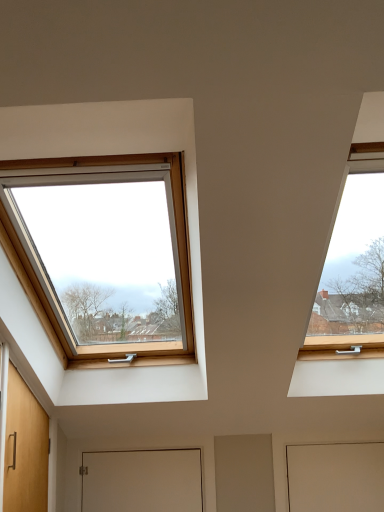
Identify the location of white matte door at lower right, the 2th door from the left. This screenshot has width=384, height=512. (336, 477).

Describe the element at coordinates (336, 477) in the screenshot. The image size is (384, 512). I see `white matte door at lower right, the first door in the right-to-left sequence` at that location.

Measure the distance between white matte door at lower right, the first door in the right-to-left sequence, and camera.

Answer: white matte door at lower right, the first door in the right-to-left sequence, is 8.12 feet from camera.

Describe the element at coordinates (142, 481) in the screenshot. This screenshot has width=384, height=512. I see `white matte door at center, the 1th door in the left-to-right sequence` at that location.

What is the approximate width of white matte door at center, the 1th door in the left-to-right sequence?

The width of white matte door at center, the 1th door in the left-to-right sequence, is 3.54 centimeters.

The width and height of the screenshot is (384, 512). Identify the location of white matte door at center, the 2th door when ordered from right to left. (142, 481).

At what (x,y) coordinates should I click in order to perform the action: click on white matte door at lower right, the first door in the right-to-left sequence. Please return your answer as a coordinate pair (x, y). Looking at the image, I should click on (336, 477).

Based on the photo, is white matte door at center, the 2th door when ordered from right to left, at the right side of white matte door at lower right, the first door in the right-to-left sequence?

Incorrect, white matte door at center, the 2th door when ordered from right to left, is not on the right side of white matte door at lower right, the first door in the right-to-left sequence.

Does white matte door at center, the 1th door in the left-to-right sequence, lie in front of white matte door at lower right, the 2th door from the left?

No, it is behind white matte door at lower right, the 2th door from the left.

Considering the positions of points (156, 481) and (337, 487), is point (156, 481) closer to camera compared to point (337, 487)?

No, it is behind (337, 487).

From the image's perspective, is white matte door at center, the 2th door when ordered from right to left, positioned above or below white matte door at lower right, the first door in the right-to-left sequence?

Based on their image positions, white matte door at center, the 2th door when ordered from right to left, is located beneath white matte door at lower right, the first door in the right-to-left sequence.

From a real-world perspective, who is located higher, white matte door at center, the 1th door in the left-to-right sequence, or white matte door at lower right, the 2th door from the left?

From a 3D spatial view, white matte door at center, the 1th door in the left-to-right sequence, is above.

Which object is thinner, white matte door at center, the 1th door in the left-to-right sequence, or white matte door at lower right, the 2th door from the left?

white matte door at center, the 1th door in the left-to-right sequence, is thinner.

Is white matte door at center, the 1th door in the left-to-right sequence, taller than white matte door at lower right, the first door in the right-to-left sequence?

In fact, white matte door at center, the 1th door in the left-to-right sequence, may be shorter than white matte door at lower right, the first door in the right-to-left sequence.

Which of these two, white matte door at center, the 2th door when ordered from right to left, or white matte door at lower right, the first door in the right-to-left sequence, is smaller?

white matte door at lower right, the first door in the right-to-left sequence, is smaller.

Is white matte door at lower right, the first door in the right-to-left sequence, inside white matte door at center, the 2th door when ordered from right to left?

No.

In the scene shown: Are white matte door at center, the 2th door when ordered from right to left, and white matte door at lower right, the first door in the right-to-left sequence, far apart?

No, white matte door at center, the 2th door when ordered from right to left, is not far from white matte door at lower right, the first door in the right-to-left sequence.

Is white matte door at center, the 2th door when ordered from right to left, positioned with its back to white matte door at lower right, the first door in the right-to-left sequence?

No, white matte door at center, the 2th door when ordered from right to left, is not facing away from white matte door at lower right, the first door in the right-to-left sequence.

Where is `door on the right of white matte door at center, the 1th door in the left-to-right sequence`? door on the right of white matte door at center, the 1th door in the left-to-right sequence is located at coordinates (336, 477).

Between white matte door at lower right, the 2th door from the left, and white matte door at center, the 2th door when ordered from right to left, which one appears on the right side from the viewer's perspective?

From the viewer's perspective, white matte door at lower right, the 2th door from the left, appears more on the right side.

Which object is more forward, white matte door at lower right, the 2th door from the left, or white matte door at center, the 1th door in the left-to-right sequence?

Positioned in front is white matte door at lower right, the 2th door from the left.

Is point (355, 452) farther from camera compared to point (139, 488)?

Yes, point (355, 452) is behind point (139, 488).

From the image's perspective, does white matte door at lower right, the first door in the right-to-left sequence, appear higher than white matte door at center, the 1th door in the left-to-right sequence?

Yes.

From a real-world perspective, is white matte door at lower right, the 2th door from the left, physically below white matte door at center, the 1th door in the left-to-right sequence?

Yes, from a real-world perspective, white matte door at lower right, the 2th door from the left, is beneath white matte door at center, the 1th door in the left-to-right sequence.

Considering the relative sizes of white matte door at lower right, the first door in the right-to-left sequence, and white matte door at center, the 2th door when ordered from right to left, in the image provided, is white matte door at lower right, the first door in the right-to-left sequence, thinner than white matte door at center, the 2th door when ordered from right to left,?

Incorrect, the width of white matte door at lower right, the first door in the right-to-left sequence, is not less than that of white matte door at center, the 2th door when ordered from right to left.

Considering the sizes of white matte door at lower right, the first door in the right-to-left sequence, and white matte door at center, the 2th door when ordered from right to left, in the image, is white matte door at lower right, the first door in the right-to-left sequence, taller or shorter than white matte door at center, the 2th door when ordered from right to left,?

In the image, white matte door at lower right, the first door in the right-to-left sequence, appears to be taller than white matte door at center, the 2th door when ordered from right to left.

Which of these two, white matte door at lower right, the 2th door from the left, or white matte door at center, the 1th door in the left-to-right sequence, is bigger?

Bigger between the two is white matte door at center, the 1th door in the left-to-right sequence.

Does white matte door at lower right, the 2th door from the left, contain white matte door at center, the 2th door when ordered from right to left?

Definitely not — white matte door at center, the 2th door when ordered from right to left, is not inside white matte door at lower right, the 2th door from the left.

Is white matte door at lower right, the 2th door from the left, not close to white matte door at center, the 2th door when ordered from right to left?

No.

Is white matte door at lower right, the first door in the right-to-left sequence, oriented away from white matte door at center, the 1th door in the left-to-right sequence?

No.

What's the angular difference between white matte door at lower right, the first door in the right-to-left sequence, and white matte door at center, the 2th door when ordered from right to left,'s facing directions?

0.00132 degrees separate the facing orientations of white matte door at lower right, the first door in the right-to-left sequence, and white matte door at center, the 2th door when ordered from right to left.

In the image, there is a white matte door at lower right, the 2th door from the left. Identify the location of door below it (from the image's perspective). The image size is (384, 512). (142, 481).

The height and width of the screenshot is (512, 384). I want to click on door on the left of the white matte door at lower right, the first door in the right-to-left sequence, so click(x=142, y=481).

At what (x,y) coordinates should I click in order to perform the action: click on door located behind the white matte door at lower right, the 2th door from the left. Please return your answer as a coordinate pair (x, y). The height and width of the screenshot is (512, 384). Looking at the image, I should click on (142, 481).